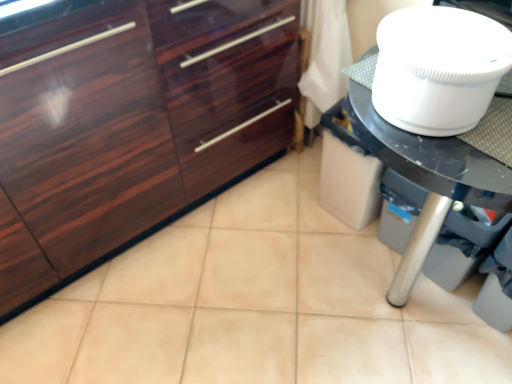
Question: Is white plastic toilet bowl at upper right further to camera compared to glossy wood cabinetry at left?

Choices:
 (A) no
 (B) yes

Answer: (A)

Question: Does white plastic toilet bowl at upper right appear on the right side of glossy wood cabinetry at left?

Choices:
 (A) yes
 (B) no

Answer: (A)

Question: Is white plastic toilet bowl at upper right to the left of glossy wood cabinetry at left from the viewer's perspective?

Choices:
 (A) no
 (B) yes

Answer: (A)

Question: From a real-world perspective, is white plastic toilet bowl at upper right physically below glossy wood cabinetry at left?

Choices:
 (A) no
 (B) yes

Answer: (A)

Question: Is white plastic toilet bowl at upper right next to glossy wood cabinetry at left?

Choices:
 (A) no
 (B) yes

Answer: (A)

Question: Considering the positions of glossy wood cabinetry at left and white glossy table at right in the image, is glossy wood cabinetry at left taller or shorter than white glossy table at right?

Choices:
 (A) tall
 (B) short

Answer: (A)

Question: From the image's perspective, is glossy wood cabinetry at left positioned above or below white glossy table at right?

Choices:
 (A) above
 (B) below

Answer: (A)

Question: From a real-world perspective, is glossy wood cabinetry at left above or below white glossy table at right?

Choices:
 (A) above
 (B) below

Answer: (A)

Question: Considering the positions of glossy wood cabinetry at left and white glossy table at right in the image, is glossy wood cabinetry at left wider or thinner than white glossy table at right?

Choices:
 (A) wide
 (B) thin

Answer: (B)

Question: Considering the positions of white plastic toilet bowl at upper right and glossy wood cabinetry at left in the image, is white plastic toilet bowl at upper right taller or shorter than glossy wood cabinetry at left?

Choices:
 (A) tall
 (B) short

Answer: (B)

Question: Relative to glossy wood cabinetry at left, is white plastic toilet bowl at upper right in front or behind?

Choices:
 (A) behind
 (B) front

Answer: (B)

Question: Considering the positions of white plastic toilet bowl at upper right and glossy wood cabinetry at left in the image, is white plastic toilet bowl at upper right wider or thinner than glossy wood cabinetry at left?

Choices:
 (A) thin
 (B) wide

Answer: (A)

Question: Is white plastic toilet bowl at upper right bigger or smaller than glossy wood cabinetry at left?

Choices:
 (A) big
 (B) small

Answer: (B)

Question: Which is correct: glossy wood cabinetry at left is inside white plastic toilet bowl at upper right, or outside of it?

Choices:
 (A) outside
 (B) inside

Answer: (A)

Question: Looking at the image, does glossy wood cabinetry at left seem bigger or smaller compared to white plastic toilet bowl at upper right?

Choices:
 (A) big
 (B) small

Answer: (A)